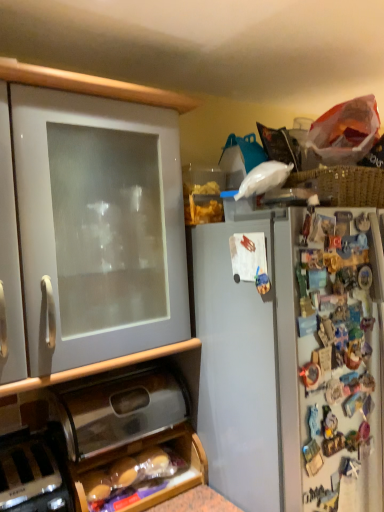
Question: Is black plastic toaster at lower left next to metallic silver breadbox at lower center, the first cabinetry from the bottom?

Choices:
 (A) yes
 (B) no

Answer: (B)

Question: Is black plastic toaster at lower left wider than metallic silver breadbox at lower center, the second cabinetry viewed from the top?

Choices:
 (A) yes
 (B) no

Answer: (A)

Question: Could you tell me if black plastic toaster at lower left is turned towards metallic silver breadbox at lower center, the first cabinetry from the bottom?

Choices:
 (A) yes
 (B) no

Answer: (B)

Question: Is black plastic toaster at lower left further to camera compared to metallic silver breadbox at lower center, the second cabinetry viewed from the top?

Choices:
 (A) no
 (B) yes

Answer: (A)

Question: Is black plastic toaster at lower left at the right side of metallic silver breadbox at lower center, the first cabinetry from the bottom?

Choices:
 (A) yes
 (B) no

Answer: (B)

Question: From a real-world perspective, is white matte cabinet at left, marked as the 2th cabinetry in a bottom-to-top arrangement, positioned above or below black plastic toaster at lower left?

Choices:
 (A) below
 (B) above

Answer: (B)

Question: In terms of size, does white matte cabinet at left, the 1th cabinetry positioned from the top, appear bigger or smaller than black plastic toaster at lower left?

Choices:
 (A) small
 (B) big

Answer: (B)

Question: Visually, is white matte cabinet at left, the 1th cabinetry positioned from the top, positioned to the left or to the right of black plastic toaster at lower left?

Choices:
 (A) left
 (B) right

Answer: (B)

Question: Is white matte cabinet at left, the 1th cabinetry positioned from the top, in front of or behind black plastic toaster at lower left in the image?

Choices:
 (A) behind
 (B) front

Answer: (B)

Question: Is metallic silver breadbox at lower center, the first cabinetry from the bottom, bigger or smaller than black plastic toaster at lower left?

Choices:
 (A) small
 (B) big

Answer: (B)

Question: Is metallic silver breadbox at lower center, the first cabinetry from the bottom, in front of or behind black plastic toaster at lower left in the image?

Choices:
 (A) front
 (B) behind

Answer: (B)

Question: From the image's perspective, is metallic silver breadbox at lower center, the first cabinetry from the bottom, positioned above or below black plastic toaster at lower left?

Choices:
 (A) above
 (B) below

Answer: (A)

Question: In the image, is metallic silver breadbox at lower center, the first cabinetry from the bottom, on the left side or the right side of black plastic toaster at lower left?

Choices:
 (A) right
 (B) left

Answer: (A)

Question: Considering the positions of point (26, 484) and point (66, 380), is point (26, 484) closer or farther from the camera than point (66, 380)?

Choices:
 (A) farther
 (B) closer

Answer: (B)

Question: Is black plastic toaster at lower left taller or shorter than metallic silver breadbox at lower center, the second cabinetry viewed from the top?

Choices:
 (A) short
 (B) tall

Answer: (B)